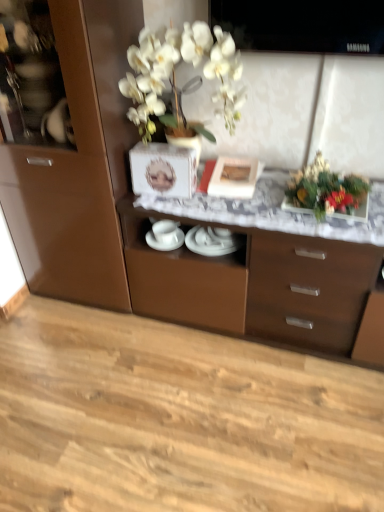
Where is `empty space that is ontop of white glossy plates at center, which appears as the 1th tableware when viewed from the right (from a real-world perspective)`? empty space that is ontop of white glossy plates at center, which appears as the 1th tableware when viewed from the right (from a real-world perspective) is located at coordinates (216, 239).